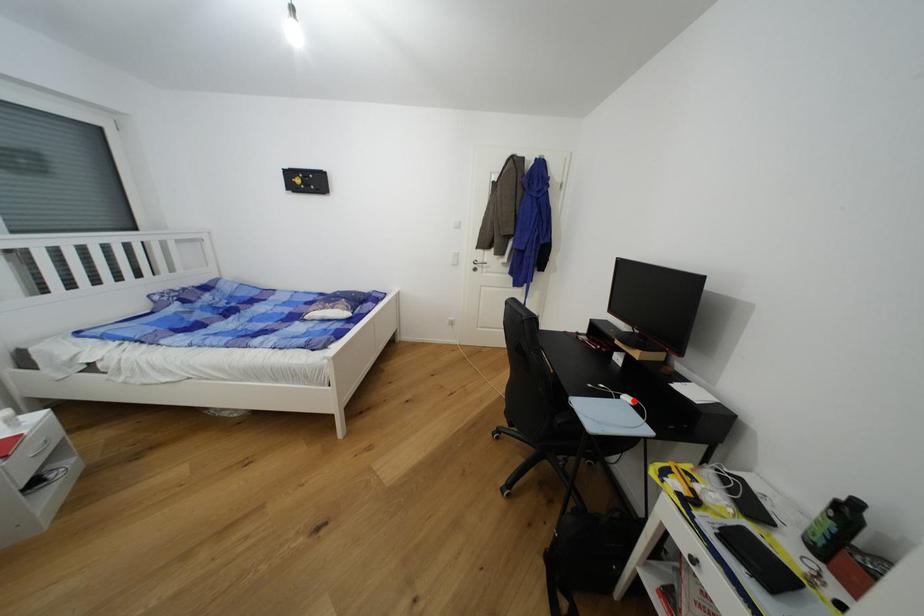
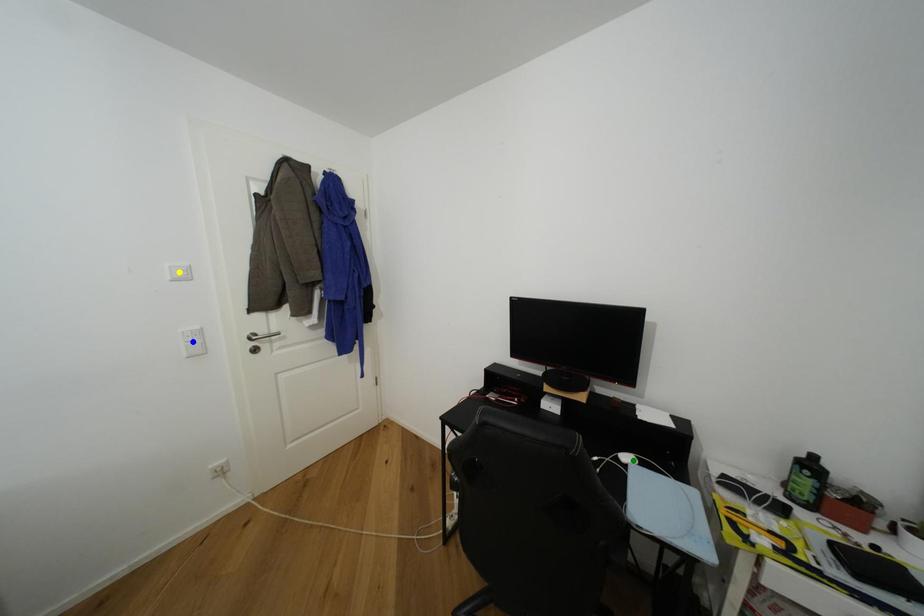
Question: I am providing you with two images of the same scene from different viewpoints. A red point is marked on the first image. You are given multiple points on the second image. Can you choose the point in image 2 that corresponds to the point in image 1?

Choices:
 (A) yellow point
 (B) blue point
 (C) green point

Answer: (C)